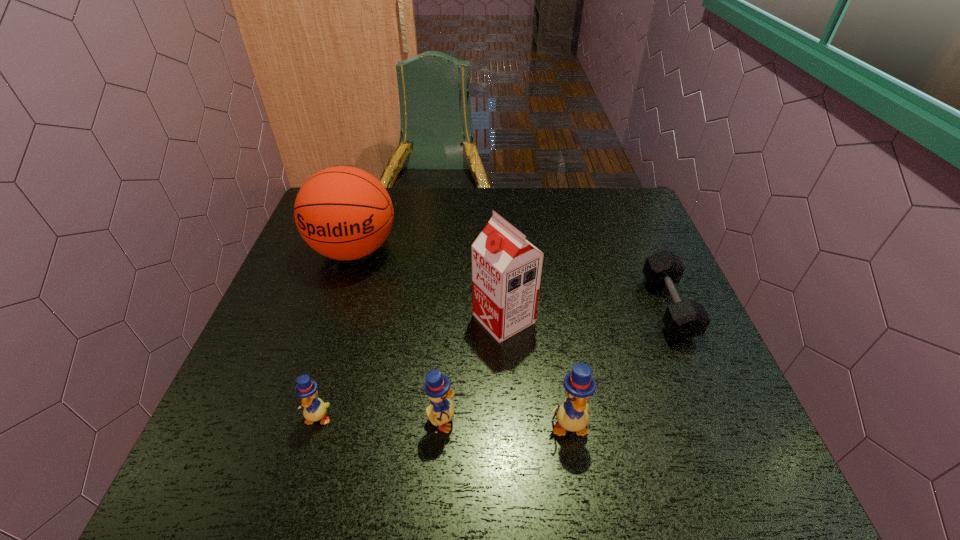
Considering the uniform spacing of ducklings, where should an additional duckling be positioned on the right? Please locate a free spot. Please provide its 2D coordinates. Your answer should be formatted as a tuple, i.e. [(x, y)], where the tuple contains the x and y coordinates of a point satisfying the conditions above.

[(695, 429)]